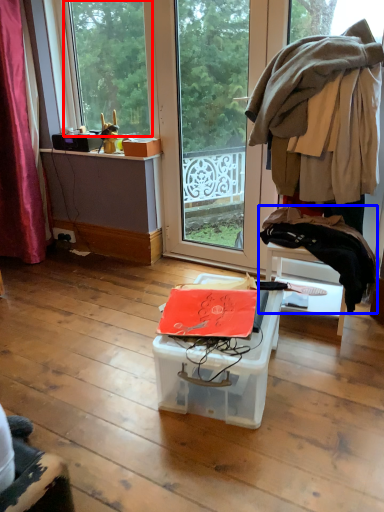
Question: Which object is further to the camera taking this photo, window (highlighted by a red box) or clothing (highlighted by a blue box)?

Choices:
 (A) window
 (B) clothing

Answer: (A)